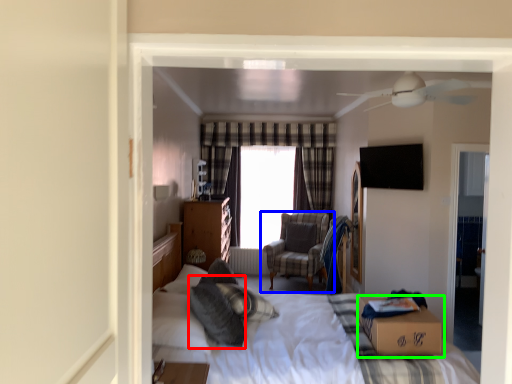
Question: Which object is positioned closest to pillow (highlighted by a red box)? Select from chair (highlighted by a blue box) and box (highlighted by a green box).

Choices:
 (A) chair
 (B) box

Answer: (B)